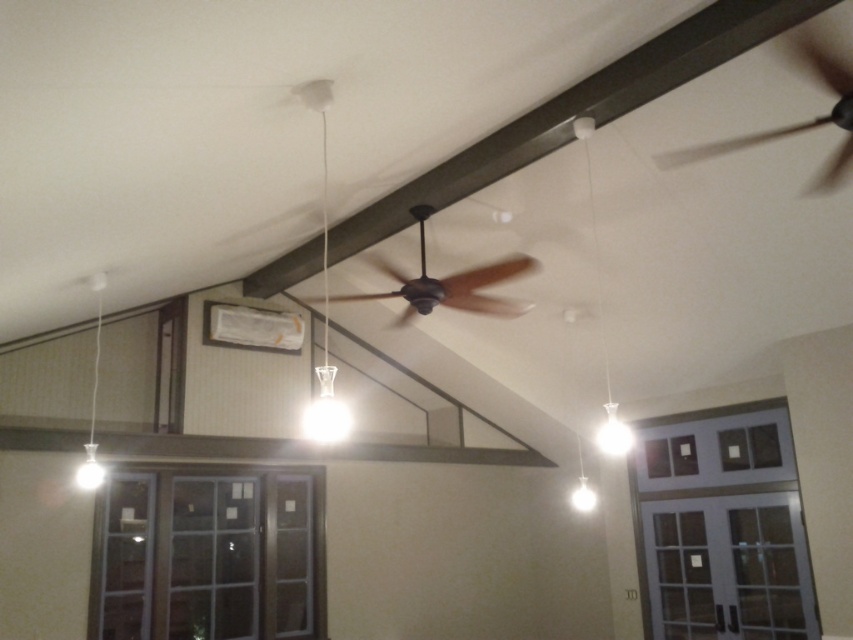
Which is more to the left, white glass pendant light at center or white glass light bulb at upper right?

From the viewer's perspective, white glass pendant light at center appears more on the left side.

Is white glass pendant light at center to the right of white glass light bulb at upper right from the viewer's perspective?

No, white glass pendant light at center is not to the right of white glass light bulb at upper right.

This screenshot has width=853, height=640. Identify the location of white glass pendant light at center. (323, 292).

In the scene shown: Who is more forward, [350,296] or [347,429]?

Positioned in front is point [350,296].

Where is `brown matte fan at center`? This screenshot has height=640, width=853. brown matte fan at center is located at coordinates (447, 284).

Can you confirm if black matte fan at upper center is smaller than white glass pendant light at left?

Yes.

Is point (819, 38) closer to camera compared to point (93, 410)?

Yes, point (819, 38) is closer to viewer.

Does point (780, 134) come behind point (97, 310)?

That is False.

Where is `black matte fan at upper center`? black matte fan at upper center is located at coordinates (799, 122).